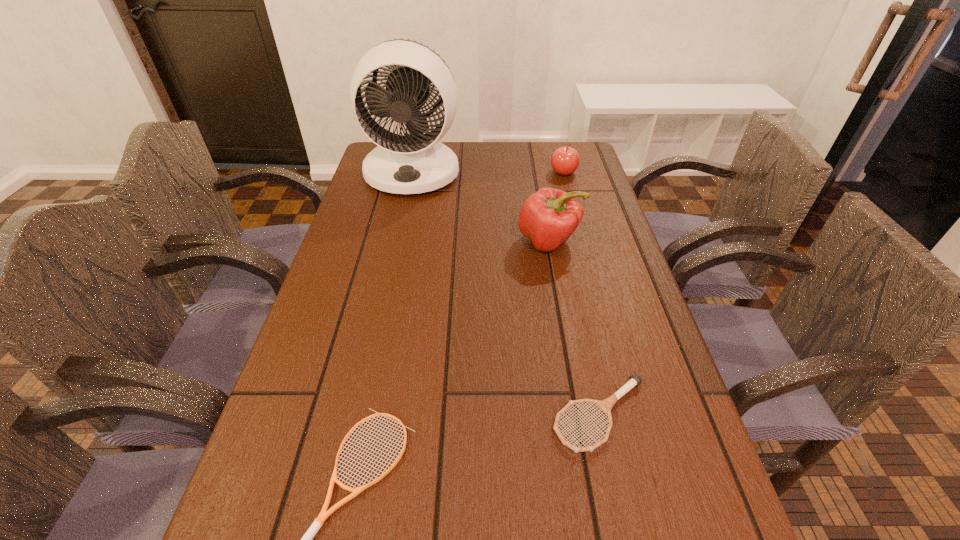
The image size is (960, 540). In order to click on vacant space that satisfies the following two spatial constraints: 1. on the grille of the taller tennis racket; 2. on the right side of the fan in this screenshot , I will do `click(360, 415)`.

Find the location of `free spot that satisfies the following two spatial constraints: 1. on the front side of the bell pepper; 2. on the left side of the right tennis racket`. free spot that satisfies the following two spatial constraints: 1. on the front side of the bell pepper; 2. on the left side of the right tennis racket is located at coordinates (582, 415).